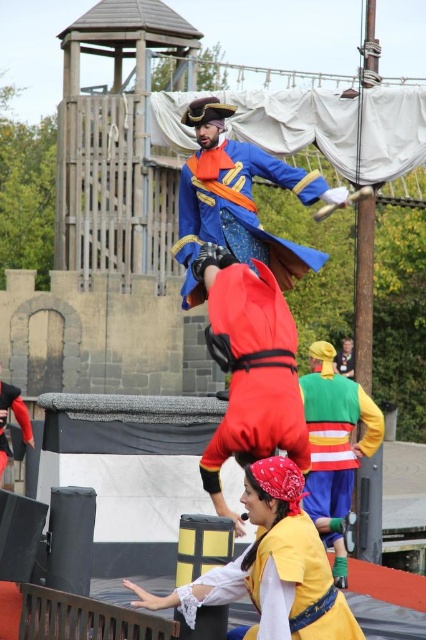
What is the object located at the point with coordinates (238, 212) in the image?

The object located at the point with coordinates (238, 212) is the blue velvet coat at center.

Based on the scene description, where is the yellow matte shield at lower center located in terms of coordinates?

The yellow matte shield at lower center is located at coordinates point (x=284, y=580).